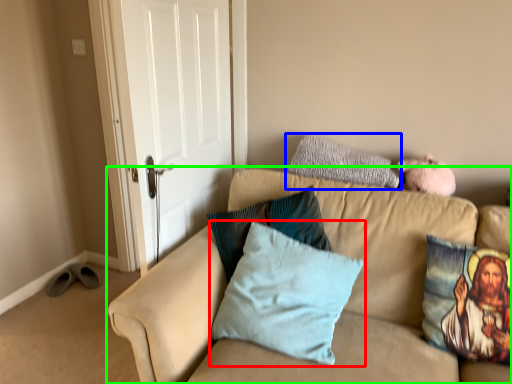
Question: Which object is the closest to the pillow (highlighted by a red box)? Choose among these: pillow (highlighted by a blue box) or studio couch (highlighted by a green box).

Choices:
 (A) pillow
 (B) studio couch

Answer: (B)